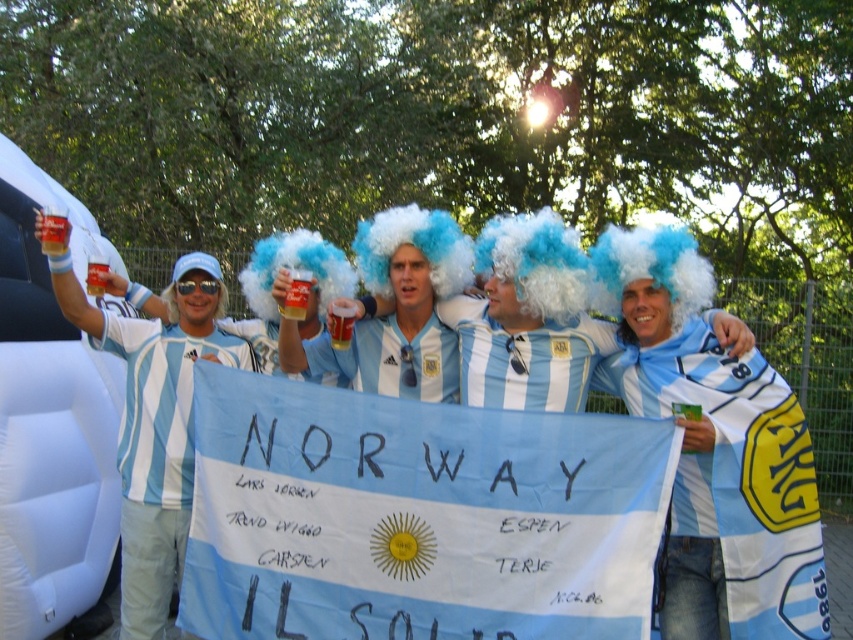
Question: Which point is farther to the camera?

Choices:
 (A) light blue striped jersey at center
 (B) matte plastic cup at center
 (C) white fluffy wig at upper left
 (D) translucent plastic cup at upper left

Answer: (C)

Question: Where is light blue striped jersey at center located in relation to white fluffy wig at upper left in the image?

Choices:
 (A) right
 (B) left

Answer: (A)

Question: Which object is the farthest from the matte plastic cup at center?

Choices:
 (A) light blue striped jersey at center
 (B) white fluffy wig at upper left

Answer: (B)

Question: Can you confirm if light blue striped jersey at center is wider than translucent plastic cup at upper left?

Choices:
 (A) no
 (B) yes

Answer: (B)

Question: Is the position of light blue striped jersey at center less distant than that of matte plastic cup at center?

Choices:
 (A) yes
 (B) no

Answer: (A)

Question: Which point is farther to the camera?

Choices:
 (A) pyautogui.click(x=65, y=237)
 (B) pyautogui.click(x=296, y=352)
 (C) pyautogui.click(x=163, y=300)

Answer: (C)